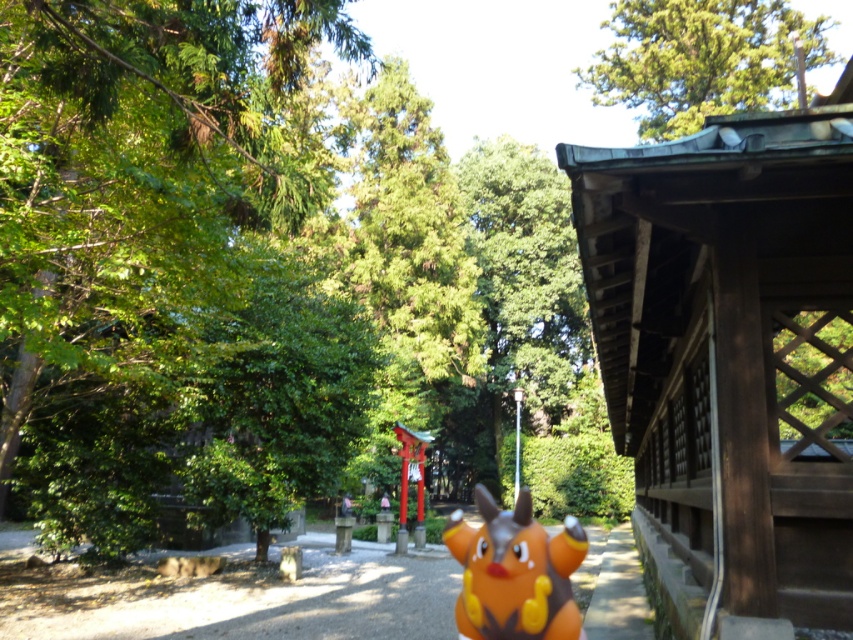
Which is above, orange plastic toy at center or orange matte plush at center?

orange plastic toy at center is above.

Can you confirm if orange plastic toy at center is smaller than orange matte plush at center?

Yes, orange plastic toy at center is smaller than orange matte plush at center.

Who is more forward, (25, 602) or (570, 528)?

Positioned in front is point (570, 528).

Where is `orange plastic toy at center`? orange plastic toy at center is located at coordinates (233, 596).